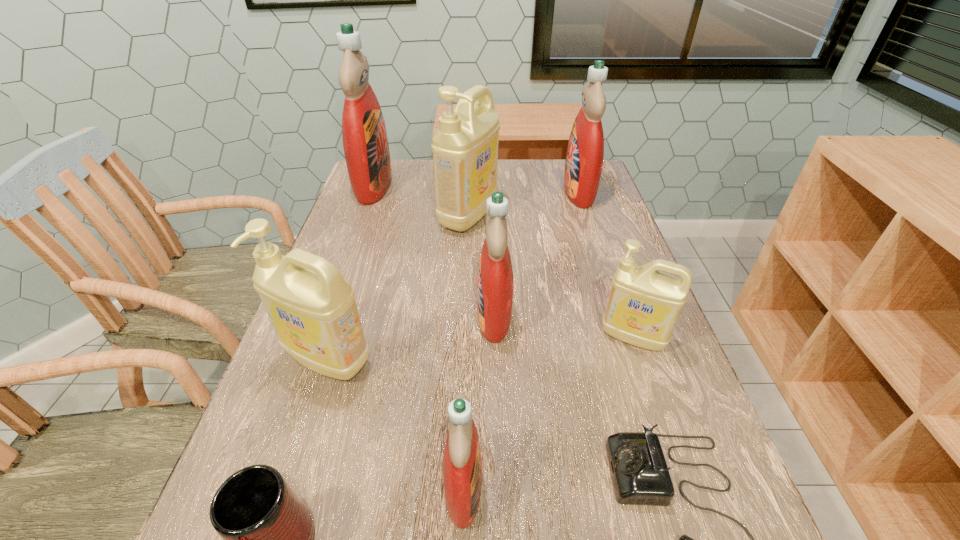
This screenshot has height=540, width=960. In order to click on vacant space that is in between the tallest object and the farthest beige detergent in this screenshot , I will do `click(421, 200)`.

Where is `empty space that is in between the tallest detergent and the nearest detergent`? empty space that is in between the tallest detergent and the nearest detergent is located at coordinates coord(419,336).

Where is `object that is the second closest one to the nearest detergent`? This screenshot has height=540, width=960. object that is the second closest one to the nearest detergent is located at coordinates (268, 533).

Locate an element on the screen. This screenshot has width=960, height=540. object that stands as the third closest to the second beige detergent from left to right is located at coordinates (585, 152).

Image resolution: width=960 pixels, height=540 pixels. Identify the location of detergent that is the third closest one to the second beige detergent from left to right. click(585, 152).

Point out which detergent is positioned as the second nearest to the leftmost beige detergent. Please provide its 2D coordinates. Your answer should be formatted as a tuple, i.e. [(x, y)], where the tuple contains the x and y coordinates of a point satisfying the conditions above.

[(495, 281)]

Point out which red detergent is positioned as the third nearest to the smallest red detergent. Please provide its 2D coordinates. Your answer should be formatted as a tuple, i.e. [(x, y)], where the tuple contains the x and y coordinates of a point satisfying the conditions above.

[(365, 142)]

Choose which red detergent is the second nearest neighbor to the third smallest red detergent. Please provide its 2D coordinates. Your answer should be formatted as a tuple, i.e. [(x, y)], where the tuple contains the x and y coordinates of a point satisfying the conditions above.

[(365, 142)]

Find the location of a particular element. The height and width of the screenshot is (540, 960). beige detergent identified as the closest to the second nearest red detergent is located at coordinates (644, 304).

Point out which beige detergent is positioned as the nearest to the smallest beige detergent. Please provide its 2D coordinates. Your answer should be formatted as a tuple, i.e. [(x, y)], where the tuple contains the x and y coordinates of a point satisfying the conditions above.

[(465, 148)]